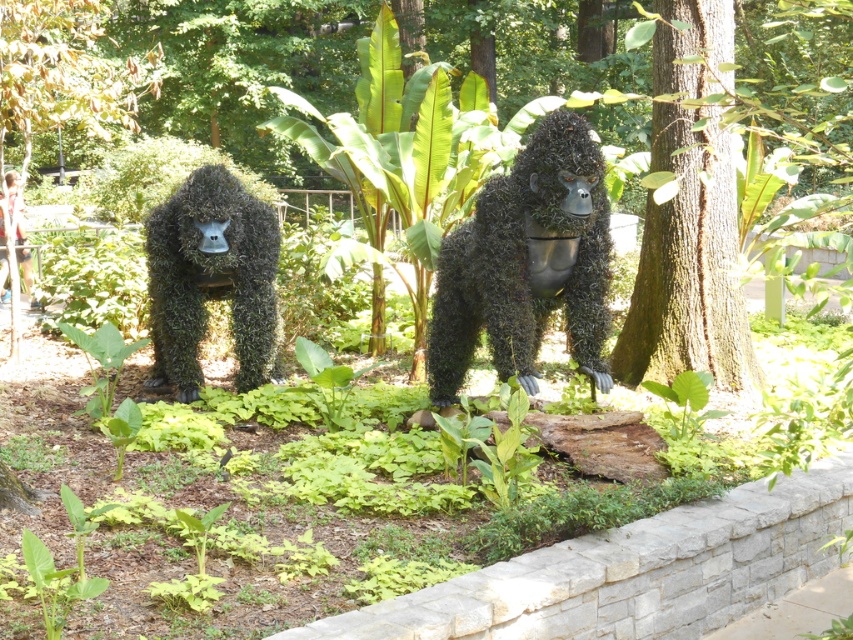
You are standing in the garden and want to take a photo of the green mossy gorilla at left without the green rough bark tree at center blocking the view. Which direction should you move to ensure the tree is out of frame?

Move to the left side of the green mossy gorilla at left so that the green rough bark tree at center is no longer in front of it. Since the green rough bark tree at center is above the green mossy gorilla at left, moving sideways away from the tree would allow you to capture the gorilla without the tree obstructing the view.

You are a gardener planning to place a new bench between the green rough bark tree at center and the green mossy gorilla at center. Which object should you place the bench closer to if you want the bench to be near the narrower object?

The green rough bark tree at center has a lesser width compared to the green mossy gorilla at center, so you should place the bench closer to the green rough bark tree at center to be near the narrower object.